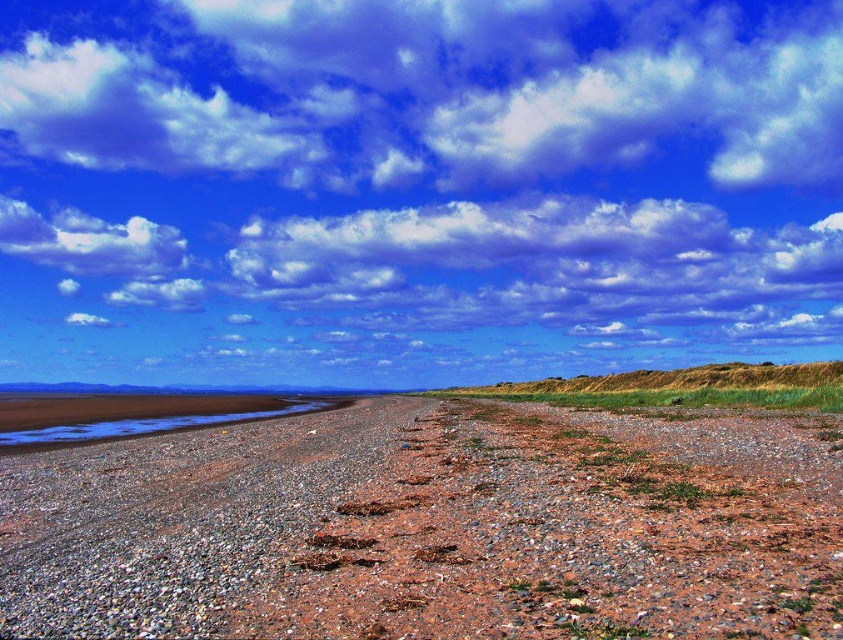
Is point (776, 256) less distant than point (199, 474)?

No, it is behind (199, 474).

Which is in front, point (788, 305) or point (787, 483)?

Positioned in front is point (787, 483).

I want to click on cloudy blue sky at upper center, so click(415, 188).